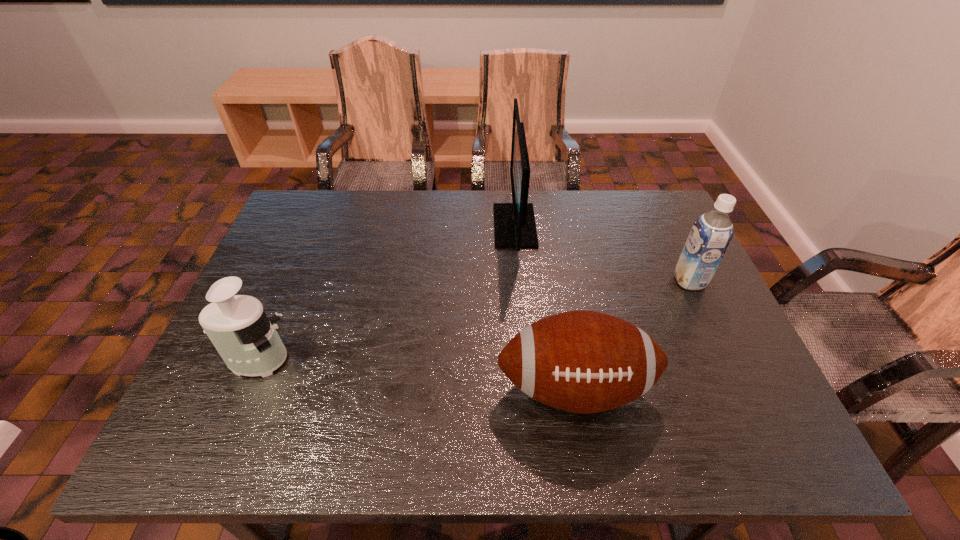
Locate an element on the screen. The image size is (960, 540). the tallest object is located at coordinates (514, 223).

You are a GUI agent. You are given a task and a screenshot of the screen. Output one action in this format:
    pyautogui.click(x=<x>, y=<y>)
    Task: Click on the monitor
    The image size is (960, 540).
    Given the screenshot: What is the action you would take?
    pyautogui.click(x=514, y=223)

Locate an element on the screen. Image resolution: width=960 pixels, height=540 pixels. the third nearest object is located at coordinates coord(711,234).

Locate an element on the screen. soya milk is located at coordinates (x=711, y=234).

The height and width of the screenshot is (540, 960). What are the coordinates of `juicer` in the screenshot? It's located at (237, 325).

Locate an element on the screen. the shortest object is located at coordinates (581, 361).

Identify the location of vacant region located on the screen side of the tallest object. The width and height of the screenshot is (960, 540). (474, 226).

Find the location of a particular element. free space located on the screen side of the tallest object is located at coordinates (455, 226).

At what (x,y) coordinates should I click in order to perform the action: click on blank area located 0.080m on the screen side of the tallest object. Please return your answer as a coordinate pair (x, y). Looking at the image, I should click on (468, 226).

Where is `free space located on the label of the third nearest object`? The height and width of the screenshot is (540, 960). free space located on the label of the third nearest object is located at coordinates (619, 281).